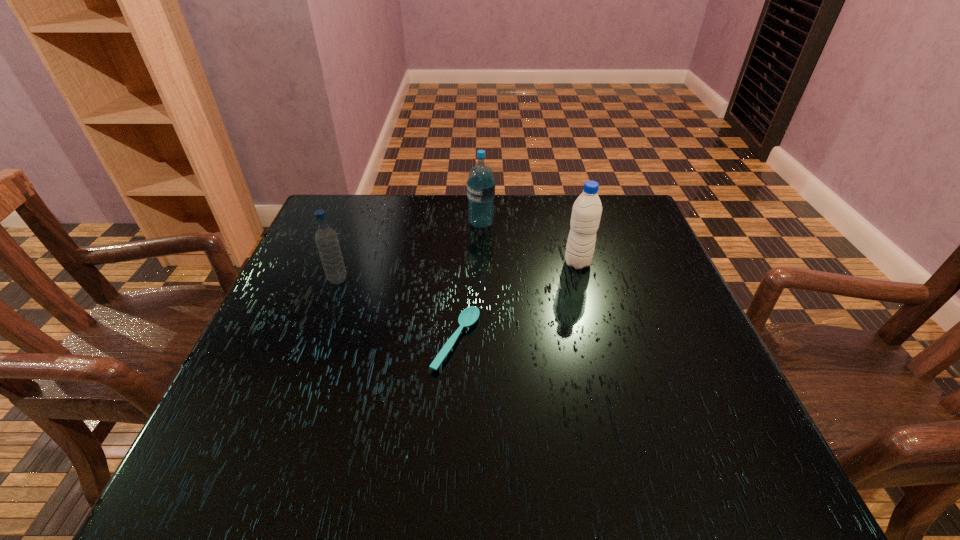
Where is `the third closest object to the nearest object`? the third closest object to the nearest object is located at coordinates pyautogui.click(x=481, y=185).

Choose which object is the third nearest neighbor to the third farthest object. Please provide its 2D coordinates. Your answer should be formatted as a tuple, i.e. [(x, y)], where the tuple contains the x and y coordinates of a point satisfying the conditions above.

[(586, 213)]

This screenshot has width=960, height=540. I want to click on water bottle that is the closest to the rightmost object, so click(x=481, y=185).

Find the location of a particular element. The width and height of the screenshot is (960, 540). water bottle that is the third closest one to the shortest object is located at coordinates coord(481,185).

This screenshot has width=960, height=540. I want to click on free point that satisfies the following two spatial constraints: 1. on the back side of the second farthest object; 2. on the left side of the shortest object, so click(461, 263).